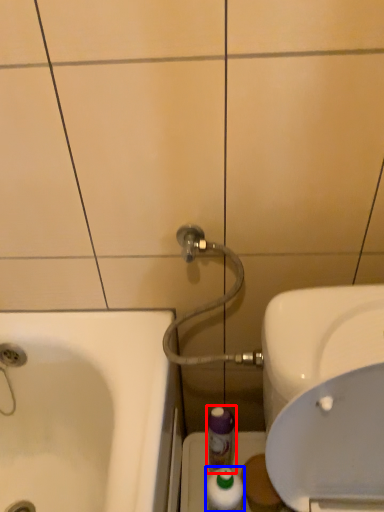
Question: Which object appears closest to the camera in this image, mouthwash (highlighted by a red box) or mouthwash (highlighted by a blue box)?

Choices:
 (A) mouthwash
 (B) mouthwash

Answer: (B)